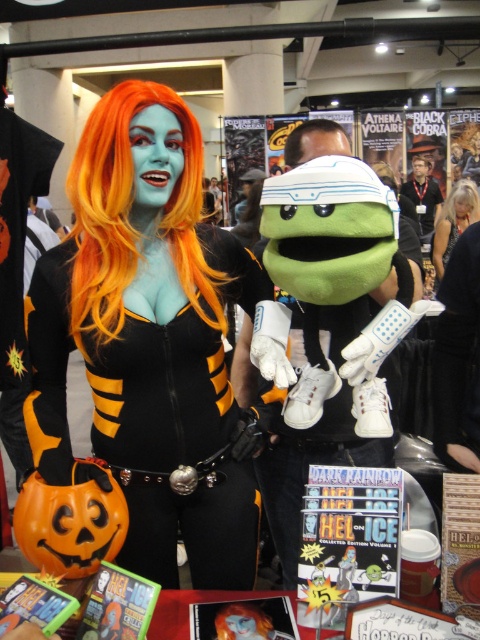
Question: Is orange synthetic wig at center positioned in front of black matte wig at upper center?

Choices:
 (A) yes
 (B) no

Answer: (A)

Question: Estimate the real-world distances between objects in this image. Which object is farther from the matte black costume at center?

Choices:
 (A) black matte wig at upper center
 (B) orange synthetic wig at center

Answer: (A)

Question: Among these points, which one is nearest to the camera?

Choices:
 (A) (72, 180)
 (B) (459, 209)

Answer: (A)

Question: Where is orange synthetic wig at center located in relation to blonde synthetic wig at upper right in the image?

Choices:
 (A) above
 (B) below

Answer: (B)

Question: Does black matte wig at upper center have a lesser width compared to blonde synthetic wig at upper right?

Choices:
 (A) yes
 (B) no

Answer: (B)

Question: Which point appears farthest from the camera in this image?

Choices:
 (A) (468, 196)
 (B) (477, 202)

Answer: (A)